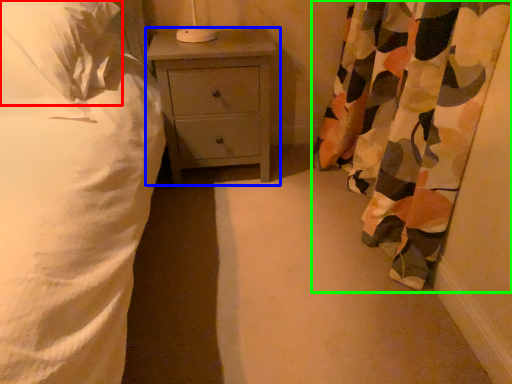
Question: Which object is the closest to the pillow (highlighted by a red box)? Choose among these: nightstand (highlighted by a blue box) or curtain (highlighted by a green box).

Choices:
 (A) nightstand
 (B) curtain

Answer: (A)